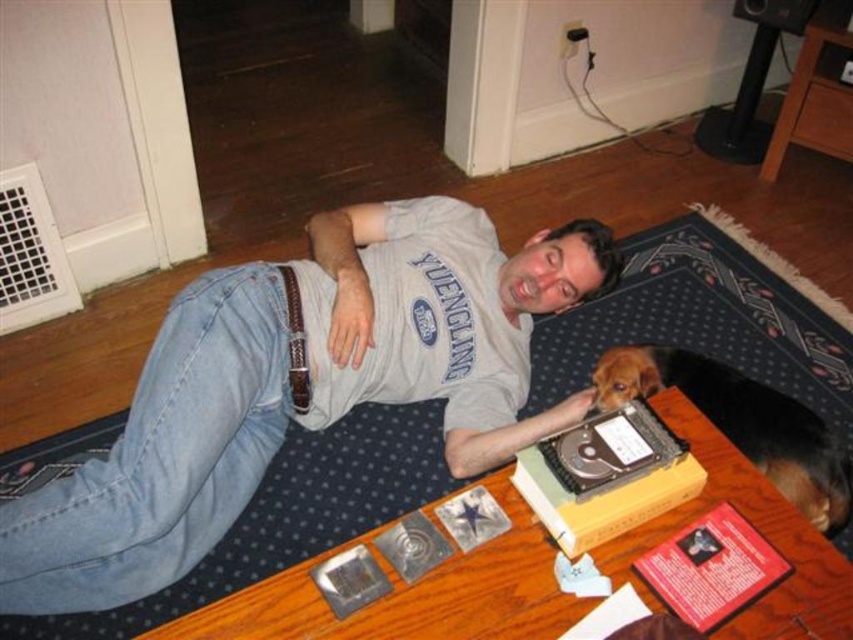
Is gray cotton t-shirt at center positioned before brown furry dog at upper right?

Yes.

Which of these two, gray cotton t-shirt at center or brown furry dog at upper right, stands taller?

gray cotton t-shirt at center is taller.

This screenshot has height=640, width=853. What do you see at coordinates (302, 387) in the screenshot? I see `gray cotton t-shirt at center` at bounding box center [302, 387].

Find the location of a particular element. gray cotton t-shirt at center is located at coordinates (302, 387).